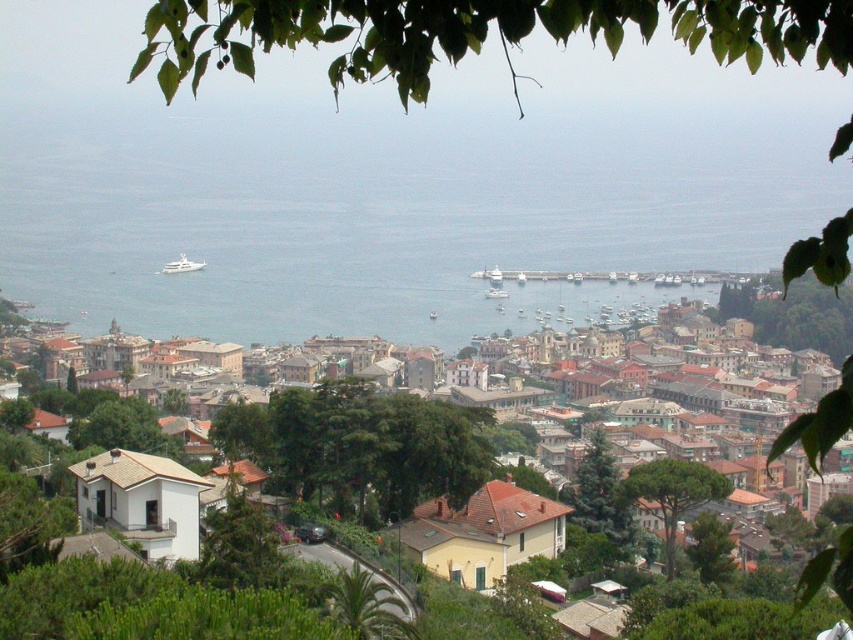
You are standing at the point labeled point [474,33] in the image. Looking around, you see a green leafy tree at upper center. Which direction should you face to see the green leafy tree at upper center?

You are already at the point labeled point [474,33], which is on the green leafy tree at upper center, so you are facing the tree itself.

You are standing at the point marked as point (386, 218) in the image. What do you see immediately in front of you?

You see blue water at center immediately in front of you at point (386, 218).

You are a photographer planning to capture the entire white matte building at center and green leafy tree at center in a single frame. Based on the scene description, which object would require you to adjust your camera angle to ensure both fit in the frame?

The white matte building at center has a greater width than the green leafy tree at center, so you would need to adjust your camera angle to accommodate its larger size to ensure both fit in the frame.